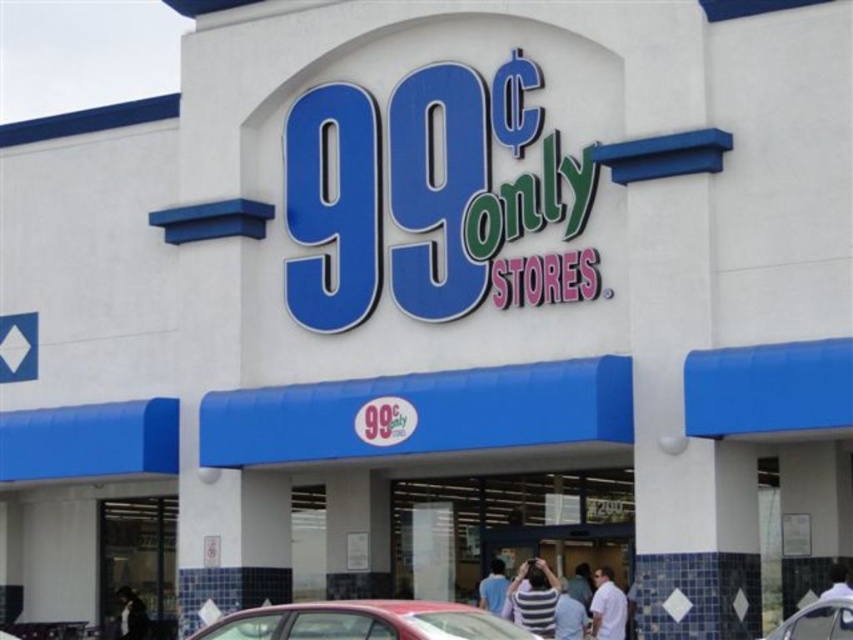
You are a customer standing in front of the store entrance. You see a striped shirt at lower center and a metallic silver car at lower right. Which object is shorter?

The striped shirt at lower center is shorter than the metallic silver car at lower right.

You are standing in front of the 99? Only Stores building and notice a metallic red car at lower center and a white cotton shirt at lower right. Which object is taller?

Answer: The metallic red car at lower center is taller than the white cotton shirt at lower right.

You are standing in front of the 99? Only Stores entrance and notice a striped shirt at lower center and a metallic silver car at lower right. Which object is closer to the entrance?

The striped shirt at lower center is closer to the entrance because it is positioned below the metallic silver car at lower right, which places it lower in the scene and thus nearer to the entrance area.